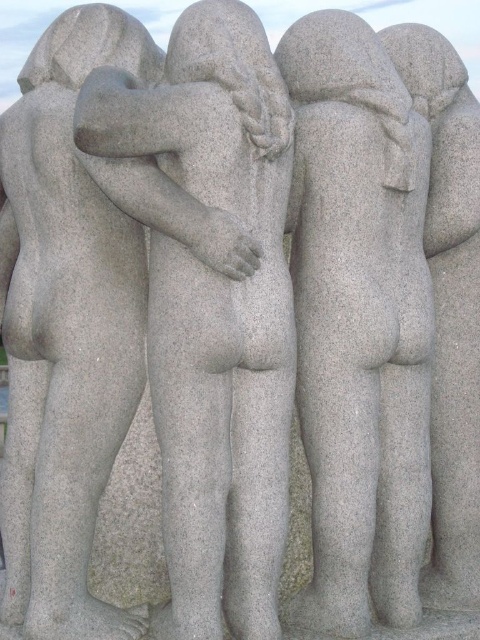
Question: Does gray granite statue at center have a larger size compared to gray granite statue at left?

Choices:
 (A) yes
 (B) no

Answer: (A)

Question: Which point is closer to the camera?

Choices:
 (A) (57, 634)
 (B) (180, 525)
 (C) (372, 586)

Answer: (B)

Question: Among these points, which one is nearest to the camera?

Choices:
 (A) (94, 525)
 (B) (330, 605)
 (C) (168, 304)

Answer: (C)

Question: Considering the real-world distances, which object is farthest from the gray stone statue at center?

Choices:
 (A) gray granite statue at left
 (B) gray granite statue at center

Answer: (B)

Question: Can you confirm if gray granite statue at center is wider than gray granite statue at left?

Choices:
 (A) yes
 (B) no

Answer: (A)

Question: Can you confirm if gray stone statue at center is positioned to the left of gray granite statue at left?

Choices:
 (A) yes
 (B) no

Answer: (B)